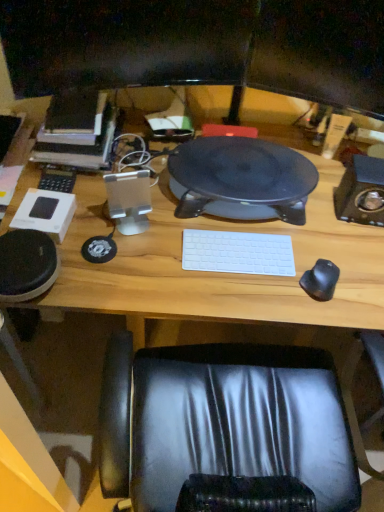
Question: Considering their positions, is wooden computer desk at center located in front of or behind black rubber mouse at right?

Choices:
 (A) behind
 (B) front

Answer: (B)

Question: In terms of size, does wooden computer desk at center appear bigger or smaller than black rubber mouse at right?

Choices:
 (A) small
 (B) big

Answer: (B)

Question: Which of these objects is positioned closest to the matte black monitor at upper center, which ranks as the first computer monitor in right-to-left order?

Choices:
 (A) wooden computer desk at center
 (B) black plastic speaker at center
 (C) black glossy monitor at upper center, acting as the 1th computer monitor starting from the left
 (D) white matte keyboard at center
 (E) hardcover book at left

Answer: (C)

Question: Based on their relative distances, which object is farther from the wooden computer desk at center?

Choices:
 (A) white matte keyboard at center
 (B) black glossy monitor at upper center, marked as the second computer monitor in a right-to-left arrangement
 (C) hardcover book at left
 (D) matte black monitor at upper center, marked as the 2th computer monitor in a left-to-right arrangement
 (E) black plastic speaker at center

Answer: (B)